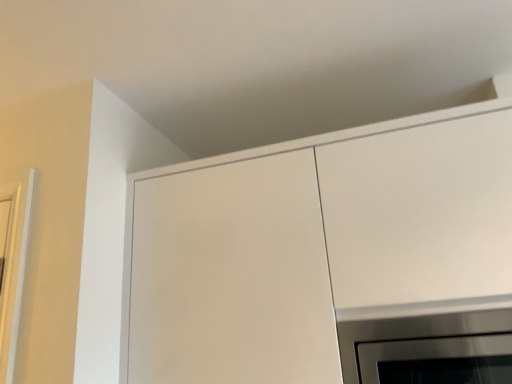
Question: Looking at their shapes, would you say stainless steel oven at lower right is wider or thinner than white matte cabinet at upper center?

Choices:
 (A) thin
 (B) wide

Answer: (A)

Question: Is stainless steel oven at lower right spatially inside white matte cabinet at upper center, or outside of it?

Choices:
 (A) outside
 (B) inside

Answer: (B)

Question: Relative to white matte cabinet at upper center, is stainless steel oven at lower right in front or behind?

Choices:
 (A) front
 (B) behind

Answer: (B)

Question: Considering the positions of white matte cabinet at upper center and stainless steel oven at lower right in the image, is white matte cabinet at upper center bigger or smaller than stainless steel oven at lower right?

Choices:
 (A) big
 (B) small

Answer: (A)

Question: Is point (448, 248) closer or farther from the camera than point (347, 340)?

Choices:
 (A) closer
 (B) farther

Answer: (A)

Question: Considering the positions of white matte cabinet at upper center and stainless steel oven at lower right in the image, is white matte cabinet at upper center wider or thinner than stainless steel oven at lower right?

Choices:
 (A) thin
 (B) wide

Answer: (B)

Question: Considering the positions of white matte cabinet at upper center and stainless steel oven at lower right in the image, is white matte cabinet at upper center taller or shorter than stainless steel oven at lower right?

Choices:
 (A) tall
 (B) short

Answer: (A)